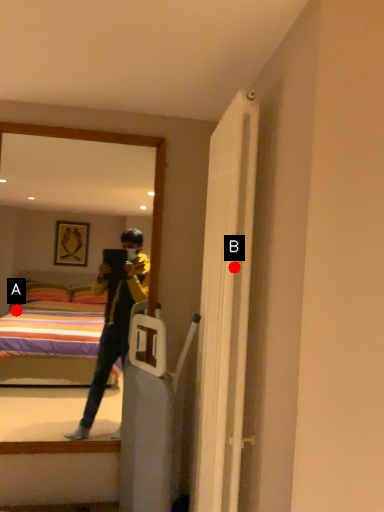
Question: Two points are circled on the image, labeled by A and B beside each circle. Among these points, which one is farthest from the camera?

Choices:
 (A) A is further
 (B) B is further

Answer: (A)